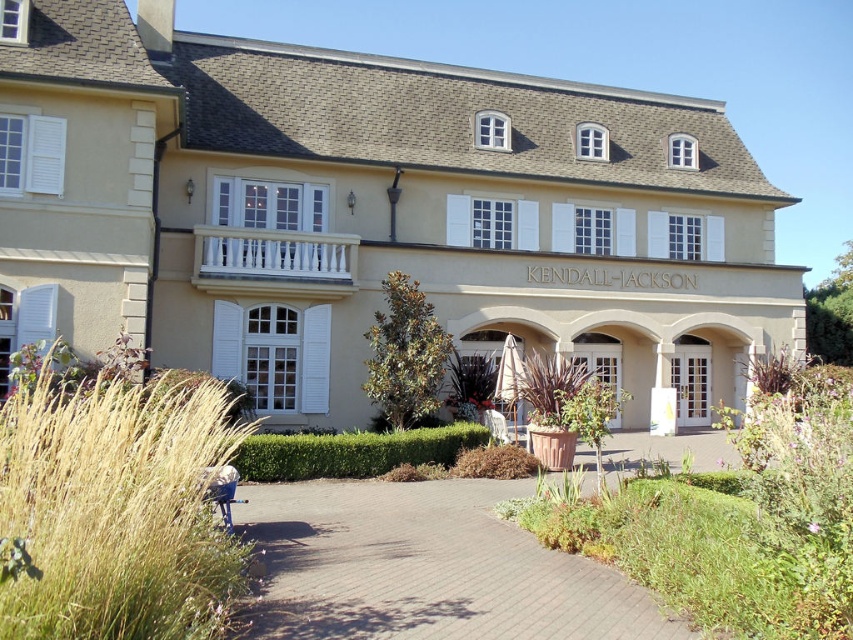
You are a gardener planning to replace the golden grass at lower left with a larger variety. Considering the paved brick driveway at center is already in place, will the new grass fit in the same space without overcrowding the area?

The golden grass at lower left currently has a smaller size compared to the paved brick driveway at center. If you replace it with a larger variety, it may overcrowd the area since the existing space was designed for a smaller plant.

You are a visitor arriving at the building and need to park your car. The beige stucco building at center has a parking lot, but you notice the paved brick driveway at center is narrower. Can your car fit into the driveway without hitting the building?

The beige stucco building at center is bigger than the paved brick driveway at center, so the driveway may not have enough space for your car to park without risking contact with the building.